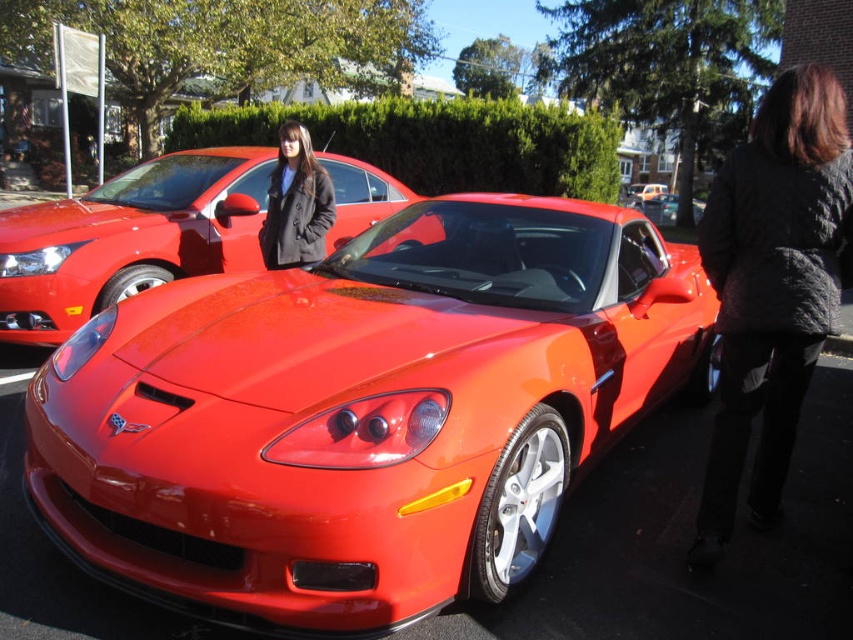
Question: Does shiny red sports car at center lie in front of glossy red car at center?

Choices:
 (A) no
 (B) yes

Answer: (B)

Question: Considering the relative positions of shiny metallic sports car at center and glossy metallic car at center in the image provided, where is shiny metallic sports car at center located with respect to glossy metallic car at center?

Choices:
 (A) below
 (B) above

Answer: (A)

Question: Which object appears farthest from the camera in this image?

Choices:
 (A) glossy metallic car at center
 (B) matte black jacket at center
 (C) dark gray quilted jacket at right

Answer: (A)

Question: Which point is closer to the camera?

Choices:
 (A) (183, 227)
 (B) (711, 280)

Answer: (B)

Question: Which of the following is the farthest from the observer?

Choices:
 (A) (751, 160)
 (B) (666, 204)

Answer: (B)

Question: Can you confirm if shiny metallic sports car at center is bigger than shiny red sports car at center?

Choices:
 (A) no
 (B) yes

Answer: (B)